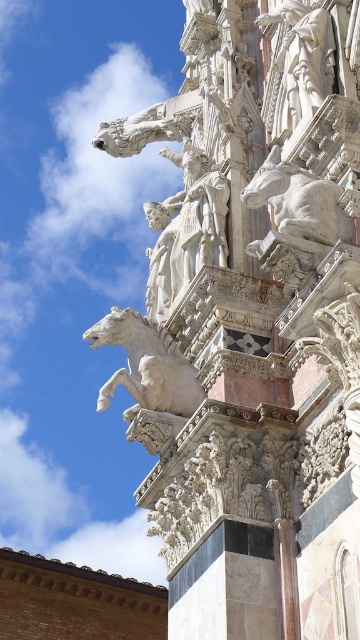
Based on the photo, you are an art student analyzing the statues in the image. You notice the white marble statue at center and the white marble horse at upper center. Which one do you think is smaller in size?

The white marble statue at center has a smaller size compared to the white marble horse at upper center, so the white marble statue at center is smaller.

You are standing in front of the ornate architectural structure and want to walk from point (182, 157) to point (172, 369). Based on the scene description, which direction should you move to reach your destination?

To move from point (182, 157) to point (172, 369), you should move forward since point (182, 157) is behind point (172, 369).